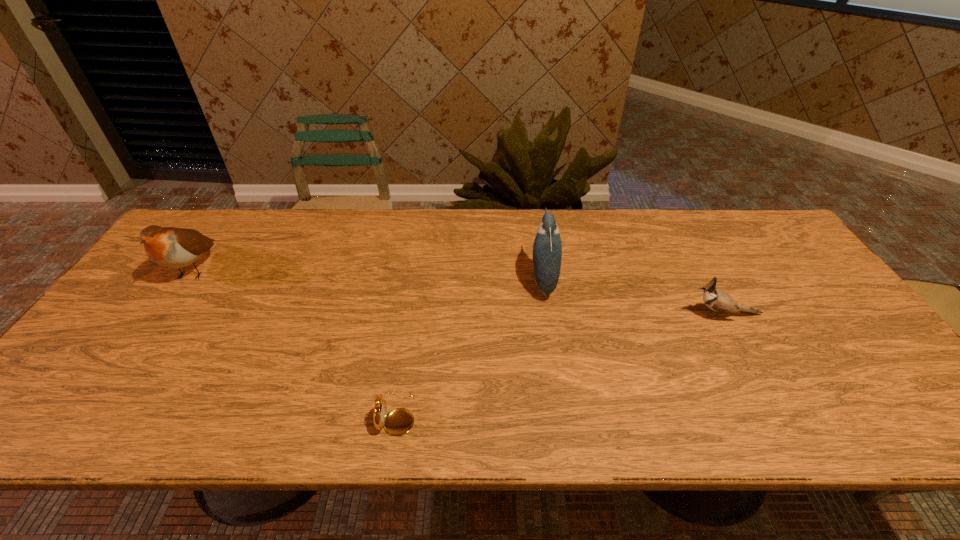
At what (x,y) coordinates should I click in order to perform the action: click on free space that is in between the second bird from right to left and the pocket watch. Please return your answer as a coordinate pair (x, y). The image size is (960, 540). Looking at the image, I should click on (469, 347).

Find the location of a particular element. The width and height of the screenshot is (960, 540). empty space between the second bird from left to right and the rightmost object is located at coordinates (634, 298).

Find the location of `vacant area that lies between the leftmost bird and the pocket watch`. vacant area that lies between the leftmost bird and the pocket watch is located at coordinates (296, 341).

Select which object is the closest to the pocket watch. Please provide its 2D coordinates. Your answer should be formatted as a tuple, i.e. [(x, y)], where the tuple contains the x and y coordinates of a point satisfying the conditions above.

[(547, 247)]

Select which object is the third closest to the third farthest object. Please provide its 2D coordinates. Your answer should be formatted as a tuple, i.e. [(x, y)], where the tuple contains the x and y coordinates of a point satisfying the conditions above.

[(172, 247)]

Identify which bird is located as the nearest to the leftmost object. Please provide its 2D coordinates. Your answer should be formatted as a tuple, i.e. [(x, y)], where the tuple contains the x and y coordinates of a point satisfying the conditions above.

[(547, 247)]

You are a GUI agent. You are given a task and a screenshot of the screen. Output one action in this format:
    pyautogui.click(x=<x>, y=<y>)
    Task: Click on the bird that is the second nearest to the shortest object
    Image resolution: width=960 pixels, height=540 pixels.
    Given the screenshot: What is the action you would take?
    pyautogui.click(x=172, y=247)